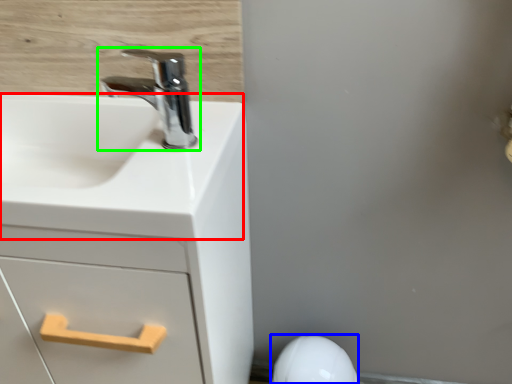
Question: Based on their relative distances, which object is nearer to counter top (highlighted by a red box)? Choose from porcelain (highlighted by a blue box) and tap (highlighted by a green box).

Choices:
 (A) porcelain
 (B) tap

Answer: (B)